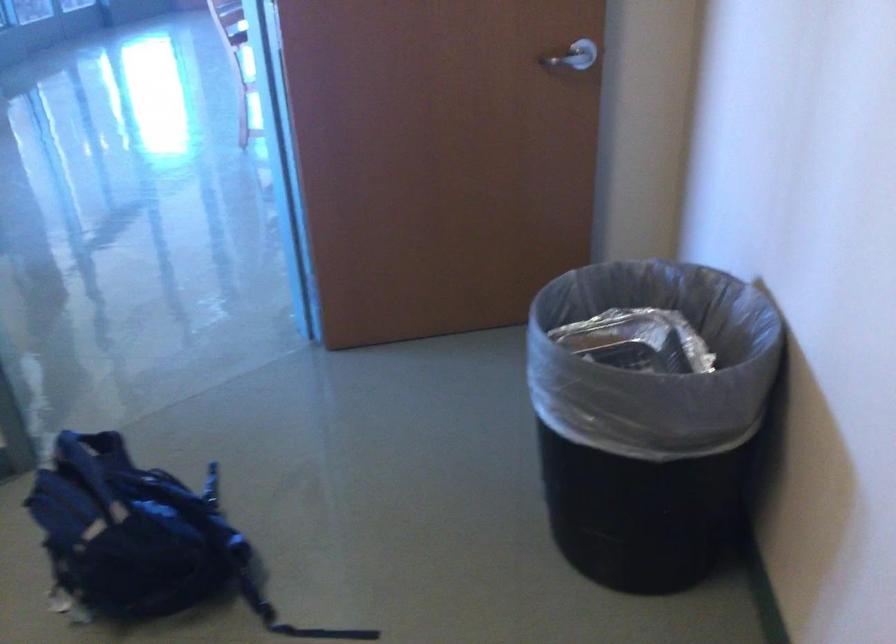
Question: Based on the continuous images, in which direction is the camera rotating? Reply with the corresponding letter.

Choices:
 (A) Left
 (B) Right
 (C) Up
 (D) Down

Answer: (A)